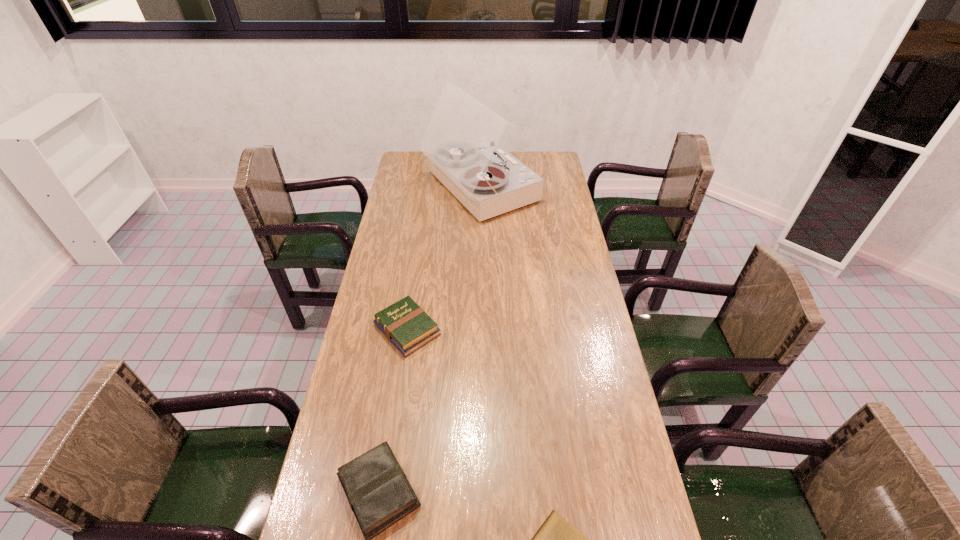
Where is `object located in the far right corner section of the desktop`? The image size is (960, 540). object located in the far right corner section of the desktop is located at coordinates (461, 140).

Locate an element on the screen. The height and width of the screenshot is (540, 960). vacant space at the far edge is located at coordinates (523, 153).

Where is `vacant space at the left edge of the desktop`? Image resolution: width=960 pixels, height=540 pixels. vacant space at the left edge of the desktop is located at coordinates (411, 200).

This screenshot has width=960, height=540. In the image, there is a desktop. Identify the location of free region at the right edge. [645, 524].

At what (x,y) coordinates should I click in order to perform the action: click on blank space at the far left corner of the desktop. Please return your answer as a coordinate pair (x, y). The width and height of the screenshot is (960, 540). Looking at the image, I should click on (416, 166).

This screenshot has width=960, height=540. In the image, there is a desktop. Identify the location of free space at the far right corner. (538, 154).

The image size is (960, 540). Identify the location of empty location between the farthest object and the farthest book. (444, 259).

Identify the location of free space between the third nearest object and the record player. The image size is (960, 540). (444, 259).

Identify the location of free space between the tallest object and the second farthest object. (444, 259).

Point out which object is positioned as the second nearest to the third nearest object. Please provide its 2D coordinates. Your answer should be formatted as a tuple, i.e. [(x, y)], where the tuple contains the x and y coordinates of a point satisfying the conditions above.

[(461, 140)]